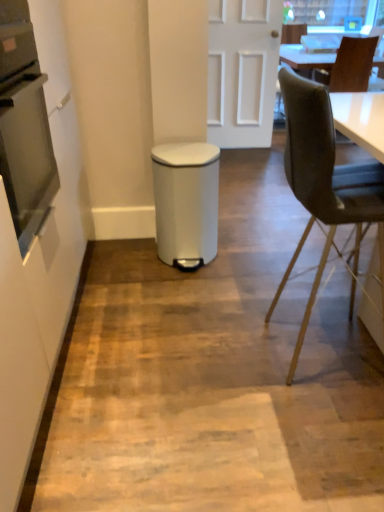
You are a GUI agent. You are given a task and a screenshot of the screen. Output one action in this format:
    pyautogui.click(x=<x>, y=<y>)
    Task: Click on the vacant space to the right of white plastic waste bin at center
    
    Given the screenshot: What is the action you would take?
    pyautogui.click(x=255, y=253)